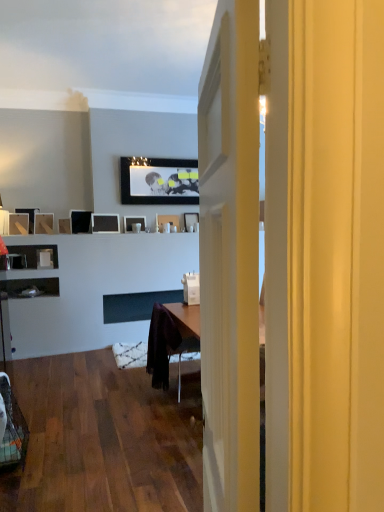
Question: Is matte wood picture frame at left, the 3th picture frame positioned from the left, to the left of matte black picture frame at left, which is the tenth picture frame in right-to-left order, from the viewer's perspective?

Choices:
 (A) yes
 (B) no

Answer: (B)

Question: Is matte wood picture frame at left, which is counted as the eighth picture frame, starting from the right, directly adjacent to matte black picture frame at left, positioned as the first picture frame in left-to-right order?

Choices:
 (A) yes
 (B) no

Answer: (B)

Question: Is matte wood picture frame at left, the 3th picture frame positioned from the left, outside matte black picture frame at left, positioned as the first picture frame in left-to-right order?

Choices:
 (A) no
 (B) yes

Answer: (B)

Question: From the image's perspective, is matte wood picture frame at left, the 3th picture frame positioned from the left, below matte black picture frame at left, positioned as the first picture frame in left-to-right order?

Choices:
 (A) no
 (B) yes

Answer: (B)

Question: Considering the relative sizes of matte wood picture frame at left, which is counted as the eighth picture frame, starting from the right, and matte black picture frame at left, positioned as the first picture frame in left-to-right order, in the image provided, is matte wood picture frame at left, which is counted as the eighth picture frame, starting from the right, shorter than matte black picture frame at left, positioned as the first picture frame in left-to-right order,?

Choices:
 (A) yes
 (B) no

Answer: (A)

Question: Is point (59, 223) closer or farther from the camera than point (147, 168)?

Choices:
 (A) farther
 (B) closer

Answer: (B)

Question: From the image's perspective, relative to matte black picture frame at upper center, which appears as the third picture frame when viewed from the right, is matte black picture frame at upper left, the 7th picture frame positioned from the right, above or below?

Choices:
 (A) above
 (B) below

Answer: (B)

Question: Considering their positions, is matte black picture frame at upper left, the fourth picture frame from the left, located in front of or behind matte black picture frame at upper center, which ranks as the 8th picture frame in left-to-right order?

Choices:
 (A) behind
 (B) front

Answer: (B)

Question: In terms of height, does matte black picture frame at upper left, the fourth picture frame from the left, look taller or shorter compared to matte black picture frame at upper center, which ranks as the 8th picture frame in left-to-right order?

Choices:
 (A) short
 (B) tall

Answer: (A)

Question: Is plastic mesh swivel chair at lower left taller or shorter than matte black picture frame at center, placed as the fifth picture frame when sorted from left to right?

Choices:
 (A) tall
 (B) short

Answer: (A)

Question: Which is correct: plastic mesh swivel chair at lower left is inside matte black picture frame at center, which is counted as the 6th picture frame, starting from the right, or outside of it?

Choices:
 (A) inside
 (B) outside

Answer: (B)

Question: From a real-world perspective, is plastic mesh swivel chair at lower left above or below matte black picture frame at center, placed as the fifth picture frame when sorted from left to right?

Choices:
 (A) below
 (B) above

Answer: (A)

Question: Does point (9, 437) appear closer or farther from the camera than point (77, 219)?

Choices:
 (A) farther
 (B) closer

Answer: (B)

Question: Considering their positions, is matte wood picture frame at left, which is counted as the eighth picture frame, starting from the right, located in front of or behind plastic mesh swivel chair at lower left?

Choices:
 (A) behind
 (B) front

Answer: (A)

Question: From a real-world perspective, is matte wood picture frame at left, the 3th picture frame positioned from the left, physically located above or below plastic mesh swivel chair at lower left?

Choices:
 (A) below
 (B) above

Answer: (B)